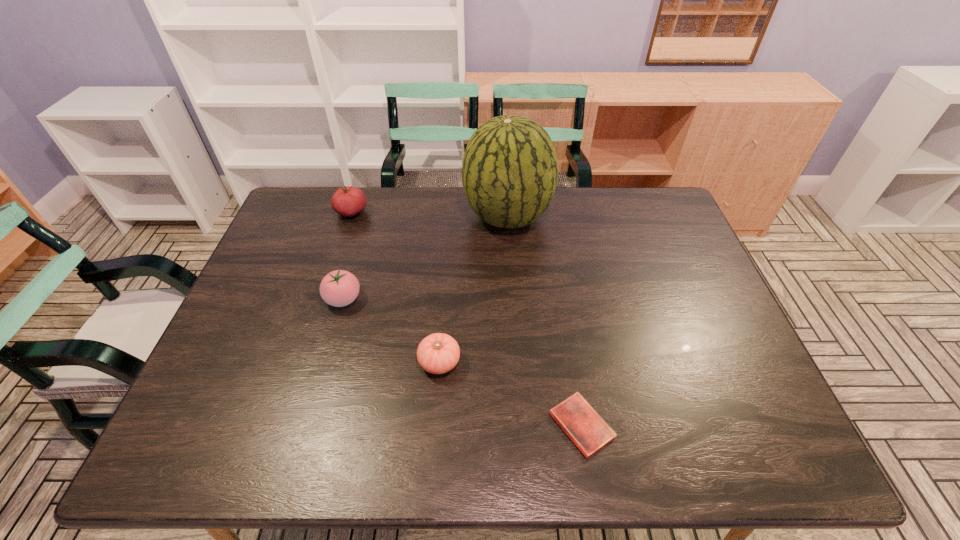
Locate an element on the screen. watermelon is located at coordinates (510, 169).

Image resolution: width=960 pixels, height=540 pixels. I want to click on the farthest tomato, so click(347, 201).

The image size is (960, 540). What are the coordinates of `the third nearest object` in the screenshot? It's located at (339, 288).

Where is `the rightmost tomato`? the rightmost tomato is located at coordinates (438, 353).

Where is `the nearest tomato`? The image size is (960, 540). the nearest tomato is located at coordinates (438, 353).

Where is `diary`? This screenshot has height=540, width=960. diary is located at coordinates (578, 419).

This screenshot has height=540, width=960. What are the coordinates of `the nearest object` in the screenshot? It's located at (578, 419).

Where is `free space located 0.150m on the left of the tallest object`? Image resolution: width=960 pixels, height=540 pixels. free space located 0.150m on the left of the tallest object is located at coordinates (419, 217).

Image resolution: width=960 pixels, height=540 pixels. In order to click on vacant space located on the front of the farthest tomato in this screenshot , I will do `click(341, 245)`.

Image resolution: width=960 pixels, height=540 pixels. Identify the location of vacant space located on the right of the second nearest tomato. (456, 299).